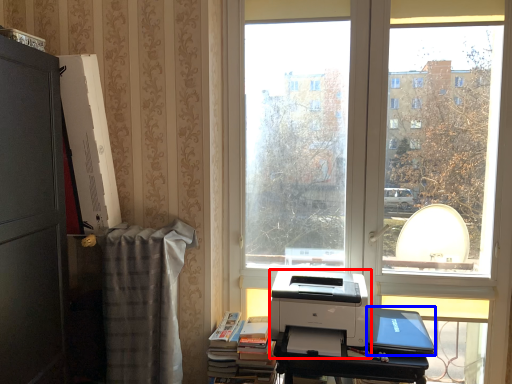
Question: Among these objects, which one is nearest to the camera, printer (highlighted by a red box) or laptop (highlighted by a blue box)?

Choices:
 (A) printer
 (B) laptop

Answer: (A)